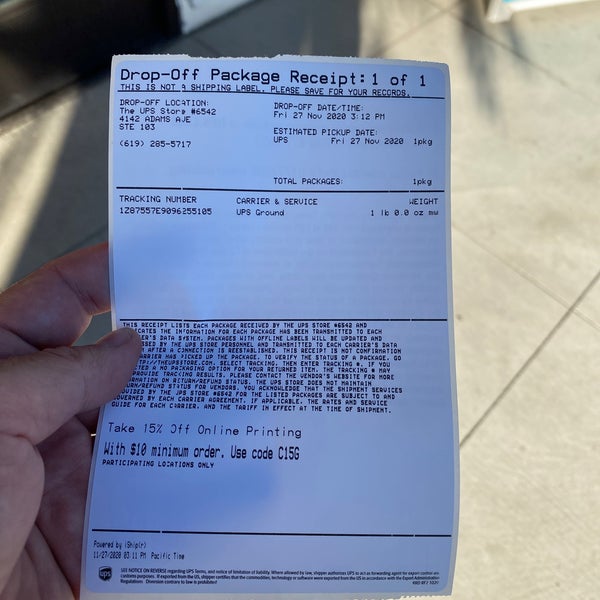
Locate an element on the screen. Image resolution: width=600 pixels, height=600 pixels. tile is located at coordinates (527, 490).